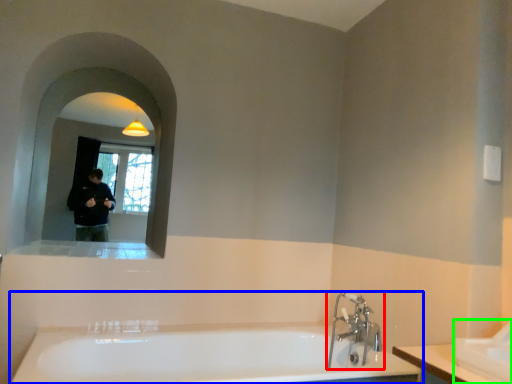
Question: Which object is the farthest from tap (highlighted by a red box)? Choose among these: bathtub (highlighted by a blue box) or sink (highlighted by a green box).

Choices:
 (A) bathtub
 (B) sink

Answer: (B)